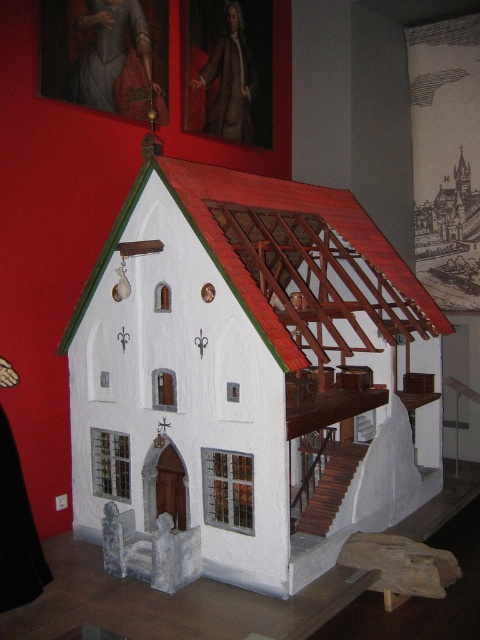
You are an interior designer arranging items on a shelf. You have a matte red cloth at upper left and a brown leather coat at upper center. Which item has a shorter height?

The matte red cloth at upper left is shorter than the brown leather coat at upper center.

You are a museum curator planning to install a motion sensor between the white painted wood chapel at center and the matte red cloth at upper left. The sensor requires a minimum of 1.5 meters of space between the two objects to function properly. Based on the scene description, will the sensor work correctly?

The white painted wood chapel at center is 1.71 meters away from the matte red cloth at upper left. Since the required minimum distance is 1.5 meters, the sensor will work correctly as the distance is sufficient.

You are standing in front of the miniature model of the traditional European house. There are two points marked on the model at coordinates point (330, 476). How far apart are these two points on the model?

The two points marked on the miniature model are 5.41 meters apart.